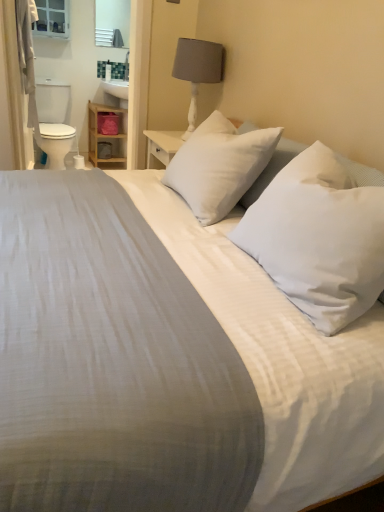
This screenshot has width=384, height=512. I want to click on white soft pillow at center, the 1th pillow in the back-to-front sequence, so click(x=219, y=167).

This screenshot has height=512, width=384. What are the coordinates of `white glossy toilet bowl at left` in the screenshot? It's located at (53, 122).

In order to face matte gray fabric lampshade at upper center, should I rotate leftwards or rightwards?

You should look right and rotate roughly 0.025 degrees.

The image size is (384, 512). Find the location of `white glossy mirror at upper center`. white glossy mirror at upper center is located at coordinates (112, 23).

Is white glossy mirror at upper center with white soft pillow at center, which is the second pillow from front to back?

No, white glossy mirror at upper center is not with white soft pillow at center, which is the second pillow from front to back.

From a real-world perspective, is white glossy mirror at upper center positioned over white soft pillow at center, which is the second pillow from front to back, based on gravity?

Correct, in the physical world, white glossy mirror at upper center is higher than white soft pillow at center, which is the second pillow from front to back.

Considering the points (115, 7) and (237, 193), which point is behind, point (115, 7) or point (237, 193)?

Point (115, 7)

Which of these two, white glossy mirror at upper center or white soft pillow at center, which is the second pillow from front to back, is bigger?

Bigger between the two is white soft pillow at center, which is the second pillow from front to back.

Can you tell me how much wooden shelf at left and white fabric curtain at left differ in facing direction?

The angle between the facing direction of wooden shelf at left and the facing direction of white fabric curtain at left is 84 degrees.

Does point (123, 146) come in front of point (25, 140)?

No, (123, 146) is further to viewer.

Could you tell me if wooden shelf at left is facing white fabric curtain at left?

No, wooden shelf at left is not facing towards white fabric curtain at left.

Which object is positioned more to the left, white glossy toilet bowl at left or matte gray fabric lampshade at upper center?

white glossy toilet bowl at left is more to the left.

Can you confirm if white glossy toilet bowl at left is taller than matte gray fabric lampshade at upper center?

Yes.

Is point (62, 90) less distant than point (183, 138)?

No.

Considering the sizes of objects white soft pillow at center, the 1th pillow in the back-to-front sequence, and white fabric curtain at left in the image provided, who is shorter, white soft pillow at center, the 1th pillow in the back-to-front sequence, or white fabric curtain at left?

white soft pillow at center, the 1th pillow in the back-to-front sequence, is shorter.

Is white soft pillow at center, which is the second pillow from front to back, bigger than white fabric curtain at left?

No.

From the image's perspective, which is above, white soft pillow at center, which is the second pillow from front to back, or white fabric curtain at left?

white fabric curtain at left.

Considering the positions of objects white soft pillow at center, the 1th pillow in the back-to-front sequence, and white fabric curtain at left in the image provided, who is more to the right, white soft pillow at center, the 1th pillow in the back-to-front sequence, or white fabric curtain at left?

From the viewer's perspective, white soft pillow at center, the 1th pillow in the back-to-front sequence, appears more on the right side.

From a real-world perspective, between white soft pillow at center, which is the second pillow from front to back, and matte gray fabric lampshade at upper center, who is vertically lower?

white soft pillow at center, which is the second pillow from front to back, is physically lower.

Looking at their sizes, would you say white soft pillow at center, which is the second pillow from front to back, is wider or thinner than matte gray fabric lampshade at upper center?

Considering their sizes, white soft pillow at center, which is the second pillow from front to back, looks broader than matte gray fabric lampshade at upper center.

How much distance is there between white soft pillow at center, which is the second pillow from front to back, and matte gray fabric lampshade at upper center?

30.88 inches.

Is point (24, 47) positioned behind point (119, 147)?

No, it is not.

Does white fabric curtain at left turn towards wooden shelf at left?

No.

How many degrees apart are the facing directions of white fabric curtain at left and wooden shelf at left?

The facing directions of white fabric curtain at left and wooden shelf at left are 84 degrees apart.

Is white fabric curtain at left in contact with wooden shelf at left?

No, white fabric curtain at left is not making contact with wooden shelf at left.

In the image, there is a white glossy toilet bowl at left. Identify the location of bedside lamp below it (from the image's perspective). (198, 70).

Is matte gray fabric lampshade at upper center oriented towards white glossy toilet bowl at left?

No, matte gray fabric lampshade at upper center is not facing towards white glossy toilet bowl at left.

From a real-world perspective, does matte gray fabric lampshade at upper center stand above white glossy toilet bowl at left?

Yes, from a real-world perspective, matte gray fabric lampshade at upper center is above white glossy toilet bowl at left.

Would you say matte gray fabric lampshade at upper center contains white glossy toilet bowl at left?

Result: No, white glossy toilet bowl at left is not a part of matte gray fabric lampshade at upper center.

At what (x,y) coordinates should I click in order to perform the action: click on mirror lying above the white soft pillow at center, which is the second pillow from front to back (from the image's perspective). Please return your answer as a coordinate pair (x, y). Looking at the image, I should click on (112, 23).

Locate an element on the screen. dresser below the white fabric curtain at left (from a real-world perspective) is located at coordinates (107, 137).

Looking at the image, which one is located closer to white glossy toilet bowl at left, wooden shelf at left or white glossy mirror at upper center?

The object closer to white glossy toilet bowl at left is wooden shelf at left.

Estimate the real-world distances between objects in this image. Which object is closer to white soft pillow at center, placed as the first pillow when sorted from front to back, white soft pillow at center, the 1th pillow in the back-to-front sequence, or matte white medicine cabinet at upper left?

white soft pillow at center, the 1th pillow in the back-to-front sequence, lies closer to white soft pillow at center, placed as the first pillow when sorted from front to back, than the other object.

Which object lies further to the anchor point matte white medicine cabinet at upper left, white soft pillow at center, the 1th pillow in the back-to-front sequence, or white glossy toilet bowl at left?

The object further to matte white medicine cabinet at upper left is white soft pillow at center, the 1th pillow in the back-to-front sequence.

Based on their spatial positions, is matte gray fabric lampshade at upper center or wooden shelf at left further from white glossy mirror at upper center?

matte gray fabric lampshade at upper center is further to white glossy mirror at upper center.

When comparing their distances from white glossy mirror at upper center, does matte white medicine cabinet at upper left or white fabric curtain at left seem closer?

matte white medicine cabinet at upper left is closer to white glossy mirror at upper center.

Considering their positions, is white soft pillow at center, placed as the first pillow when sorted from front to back, positioned further to matte gray fabric lampshade at upper center than white glossy toilet bowl at left?

white glossy toilet bowl at left lies further to matte gray fabric lampshade at upper center than the other object.

Estimate the real-world distances between objects in this image. Which object is closer to matte gray fabric lampshade at upper center, white soft pillow at center, placed as the first pillow when sorted from front to back, or white soft pillow at center, the 1th pillow in the back-to-front sequence?

Result: white soft pillow at center, the 1th pillow in the back-to-front sequence, is closer to matte gray fabric lampshade at upper center.

Which object lies nearer to the anchor point white fabric curtain at left, white glossy toilet bowl at left or wooden shelf at left?

white glossy toilet bowl at left lies closer to white fabric curtain at left than the other object.

Identify the location of medicine cabinet between white soft pillow at center, placed as the first pillow when sorted from front to back, and white glossy mirror at upper center from front to back. (52, 18).

What are the coordinates of `pillow located between white fabric curtain at left and white soft pillow at center, the second pillow when ordered from back to front, in the left-right direction` in the screenshot? It's located at (219, 167).

Identify the location of curtain positioned between white soft pillow at center, the 1th pillow in the back-to-front sequence, and white glossy mirror at upper center from near to far. (19, 76).

The width and height of the screenshot is (384, 512). Find the location of `curtain positioned between matte gray fabric lampshade at upper center and matte white medicine cabinet at upper left from near to far`. curtain positioned between matte gray fabric lampshade at upper center and matte white medicine cabinet at upper left from near to far is located at coordinates (19, 76).